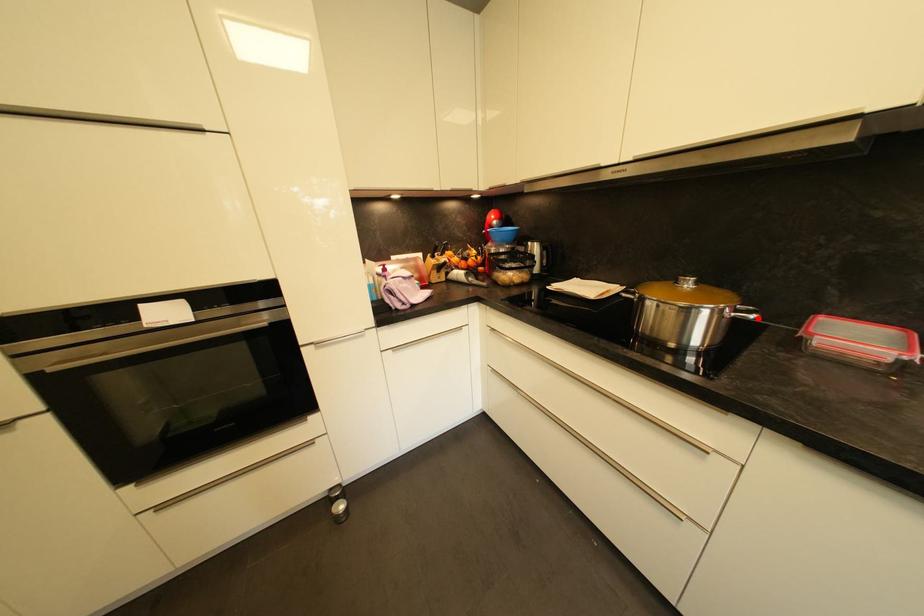
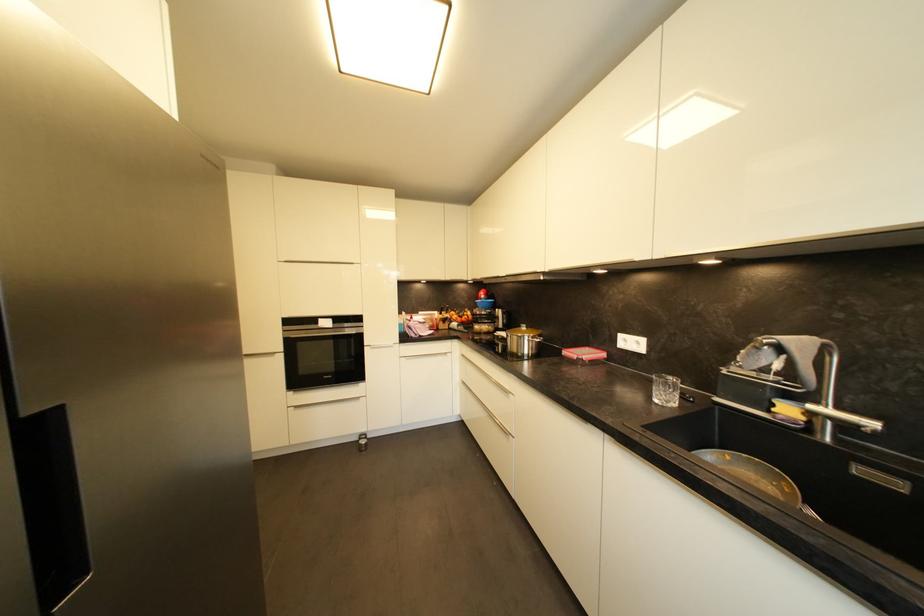
Find the pixel in the second image that matches the highlighted location in the first image.

(541, 342)